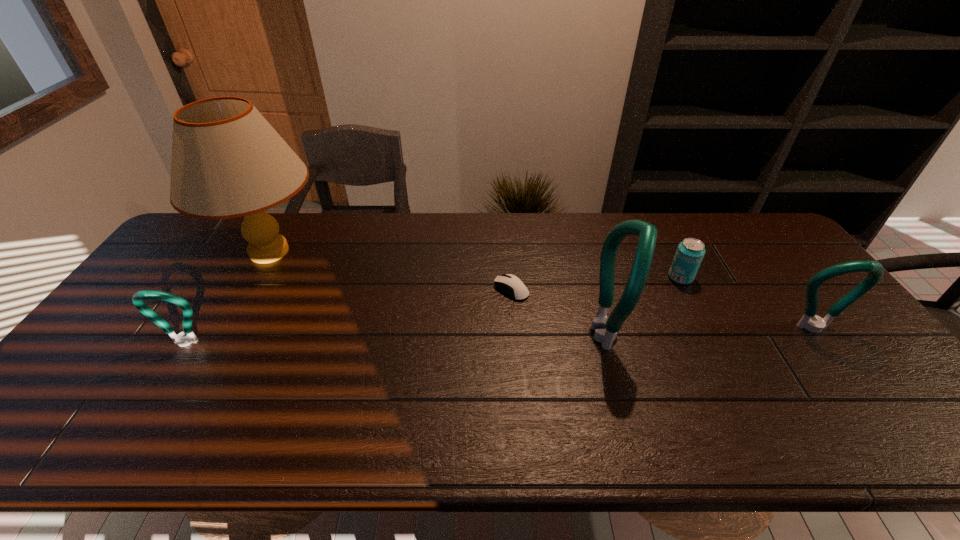
The height and width of the screenshot is (540, 960). Find the location of `free area in between the leftmost bottle opener and the second tallest bottle opener`. free area in between the leftmost bottle opener and the second tallest bottle opener is located at coordinates (499, 336).

Locate an element on the screen. vacant area that lies between the leftmost bottle opener and the fifth object from left to right is located at coordinates (433, 310).

I want to click on free spot between the tallest bottle opener and the second object from right to left, so click(x=644, y=306).

You are a GUI agent. You are given a task and a screenshot of the screen. Output one action in this format:
    pyautogui.click(x=<x>, y=<y>)
    Task: Click on the free space between the tallest object and the rightmost bottle opener
    
    Given the screenshot: What is the action you would take?
    pyautogui.click(x=541, y=291)

Locate an element on the screen. free space between the rightmost object and the tallest object is located at coordinates (541, 291).

Where is `free spot between the second tallest bottle opener and the lampshade`? free spot between the second tallest bottle opener and the lampshade is located at coordinates (541, 291).

The width and height of the screenshot is (960, 540). Identify the location of object that is the second closest to the second object from right to left. (816, 324).

Select which object appears as the fifth closest to the shortest object. Please provide its 2D coordinates. Your answer should be formatted as a tuple, i.e. [(x, y)], where the tuple contains the x and y coordinates of a point satisfying the conditions above.

[(181, 339)]

Select which bottle opener is the third closest to the beer can. Please provide its 2D coordinates. Your answer should be formatted as a tuple, i.e. [(x, y)], where the tuple contains the x and y coordinates of a point satisfying the conditions above.

[(181, 339)]

You are a GUI agent. You are given a task and a screenshot of the screen. Output one action in this format:
    pyautogui.click(x=<x>, y=<y>)
    Task: Click on the second closest bottle opener to the shortest bottle opener
    
    Given the screenshot: What is the action you would take?
    pyautogui.click(x=816, y=324)